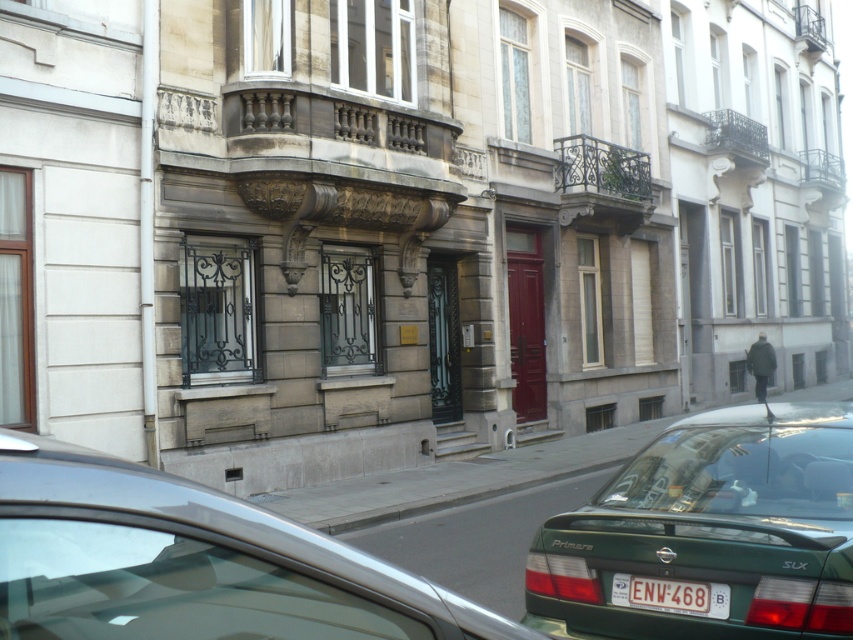
You are a delivery person trying to park a green matte car at lower right in a parking spot that can only accommodate vehicles up to the width of the white plastic license plate at center. Can the car fit in the parking spot?

The green matte car at lower right might be wider than the white plastic license plate at center, so it may not fit in the parking spot designed for vehicles up to the license plate width.

You are a delivery person who needs to park your delivery van next to the metallic silver car at lower left and the white plastic license plate at center. Considering the height of the parking spot, which object would require more vertical clearance?

The metallic silver car at lower left requires more vertical clearance because it has a greater height compared to the white plastic license plate at center.